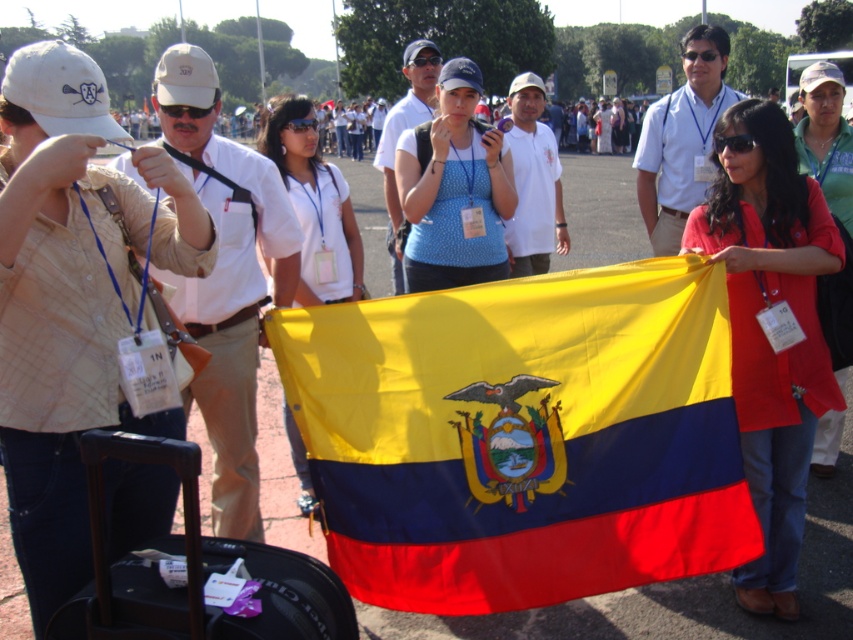
Question: Among these points, which one is farthest from the camera?

Choices:
 (A) (334, 292)
 (B) (732, 124)
 (C) (183, 435)
 (D) (198, 468)

Answer: (A)

Question: Is blue dotted shirt at center below yellow fabric flag at center?

Choices:
 (A) yes
 (B) no

Answer: (B)

Question: Is matte white shirt at center in front of matte red jacket at lower right?

Choices:
 (A) no
 (B) yes

Answer: (A)

Question: Which object is positioned closest to the beige cotton cap at upper left?

Choices:
 (A) polyester flag at center
 (B) matte white shirt at center

Answer: (A)

Question: Which is nearer to the matte red jacket at lower right?

Choices:
 (A) polyester flag at center
 (B) yellow fabric flag at center
 (C) matte red jacket at center
 (D) matte white shirt at center

Answer: (D)

Question: Is beige cotton cap at upper left to the left of matte red jacket at lower right from the viewer's perspective?

Choices:
 (A) no
 (B) yes

Answer: (B)